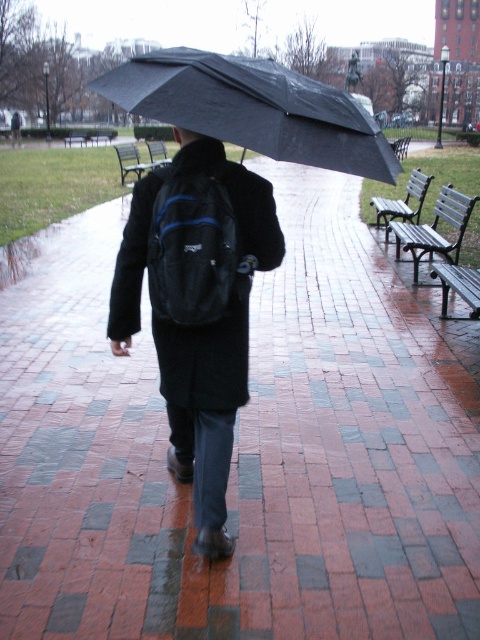
Question: Which of the following is the closest to the observer?

Choices:
 (A) black painted wood bench at right
 (B) matte black backpack at center
 (C) black matte backpack at center
 (D) black matte umbrella at center

Answer: (D)

Question: Which point is farther from the camera taking this photo?

Choices:
 (A) (406, 140)
 (B) (155, 161)
 (C) (156, 212)

Answer: (A)

Question: Does wooden park bench at center have a larger size compared to wooden bench at center?

Choices:
 (A) no
 (B) yes

Answer: (A)

Question: Which point is closer to the camera?

Choices:
 (A) black painted wood bench at right
 (B) matte black backpack at center

Answer: (B)

Question: Observing the image, what is the correct spatial positioning of black matte backpack at center in reference to metallic silver bench at left?

Choices:
 (A) below
 (B) above

Answer: (A)

Question: Is black painted wood bench at right wider than wooden bench at center?

Choices:
 (A) yes
 (B) no

Answer: (B)